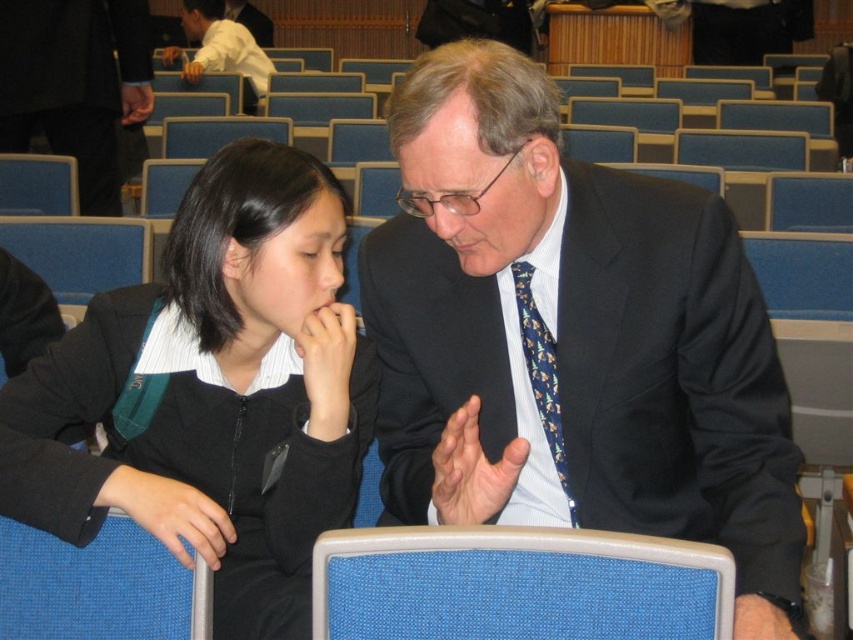
Is matte black suit at center thinner than blue floral tie at center?

No.

Does matte black suit at center lie in front of blue floral tie at center?

Yes, matte black suit at center is closer to the viewer.

The image size is (853, 640). I want to click on matte black suit at center, so click(x=572, y=339).

Where is `matte black suit at center`? The height and width of the screenshot is (640, 853). matte black suit at center is located at coordinates (572, 339).

Is matte black suit at center to the right of blue fabric chair at lower center from the viewer's perspective?

Indeed, matte black suit at center is positioned on the right side of blue fabric chair at lower center.

Who is shorter, matte black suit at center or blue fabric chair at lower center?

blue fabric chair at lower center is shorter.

Who is more forward, (x=410, y=352) or (x=556, y=616)?

Positioned in front is point (x=556, y=616).

The image size is (853, 640). I want to click on matte black suit at center, so click(572, 339).

Can you confirm if blue fabric chair at lower left is bigger than white shirt at upper left?

No, blue fabric chair at lower left is not bigger than white shirt at upper left.

Can you confirm if blue fabric chair at lower left is positioned above white shirt at upper left?

No.

You are a GUI agent. You are given a task and a screenshot of the screen. Output one action in this format:
    pyautogui.click(x=<x>, y=<y>)
    Task: Click on the blue fabric chair at lower left
    This screenshot has height=640, width=853.
    Given the screenshot: What is the action you would take?
    pyautogui.click(x=99, y=586)

Find the location of `blue fabric chair at lower left`. blue fabric chair at lower left is located at coordinates (99, 586).